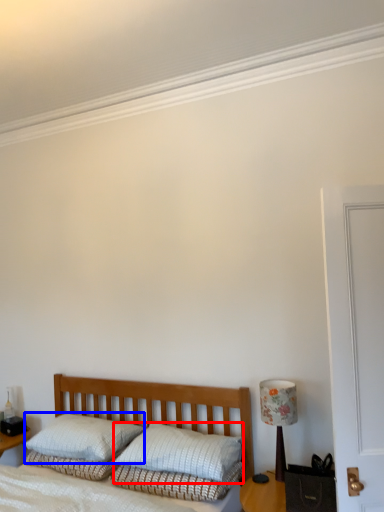
Question: Which object is closer to the camera taking this photo, pillow (highlighted by a red box) or pillow (highlighted by a blue box)?

Choices:
 (A) pillow
 (B) pillow

Answer: (A)